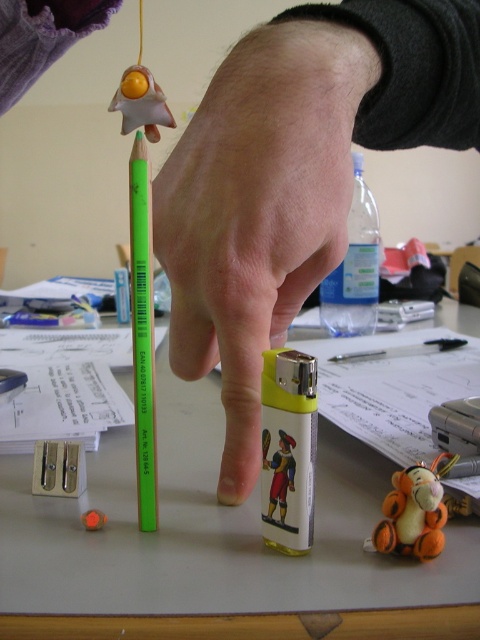
Between yellow matte lighter at center and green plastic pencil at center, which one has more height?

Standing taller between the two is yellow matte lighter at center.

Is yellow matte lighter at center to the right of green plastic pencil at center from the viewer's perspective?

Indeed, yellow matte lighter at center is positioned on the right side of green plastic pencil at center.

Is point (226, 140) behind point (152, 432)?

That is False.

Find the location of a particular element. yellow matte lighter at center is located at coordinates (257, 211).

The image size is (480, 640). What do you see at coordinates (257, 211) in the screenshot?
I see `yellow matte lighter at center` at bounding box center [257, 211].

Is yellow matte lighter at center to the left of rubber eraser at center from the viewer's perspective?

No, yellow matte lighter at center is not to the left of rubber eraser at center.

The width and height of the screenshot is (480, 640). Describe the element at coordinates (257, 211) in the screenshot. I see `yellow matte lighter at center` at that location.

The width and height of the screenshot is (480, 640). Find the location of `yellow matte lighter at center`. yellow matte lighter at center is located at coordinates (257, 211).

Does green plastic pencil at center have a lesser height compared to orange felt tigger at center?

No.

Does green plastic pencil at center come in front of orange felt tigger at center?

Yes.

Which is in front, point (146, 310) or point (386, 540)?

Positioned in front is point (386, 540).

Locate an element on the screen. green plastic pencil at center is located at coordinates (143, 332).